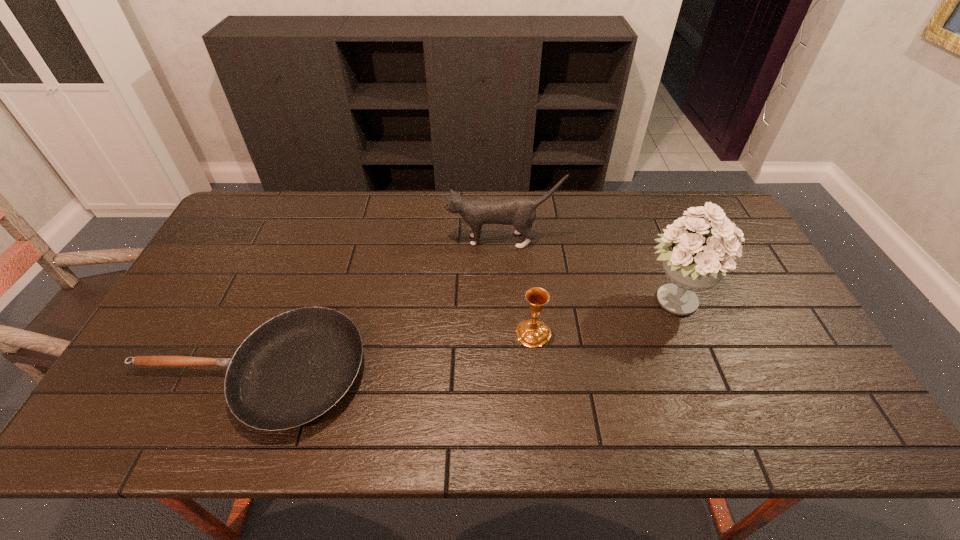
The height and width of the screenshot is (540, 960). I want to click on free space at the right edge, so click(785, 387).

In the image, there is a desktop. Find the location of `vacant space at the far left corner`. vacant space at the far left corner is located at coordinates (229, 234).

Find the location of a particular element. This screenshot has width=960, height=540. blank space at the far right corner of the desktop is located at coordinates (704, 202).

What are the coordinates of `unoccupied position between the chalice and the tallest object` in the screenshot? It's located at (603, 317).

Identify the location of vacant point located between the bouquet and the cat. pyautogui.click(x=588, y=271).

Locate an element on the screen. free space between the leftmost object and the cat is located at coordinates (375, 307).

The height and width of the screenshot is (540, 960). I want to click on free space that is in between the second shortest object and the bouquet, so click(x=603, y=317).

The image size is (960, 540). Identify the location of vacant space that is in between the chalice and the third shortest object. (517, 287).

At what (x,y) coordinates should I click in order to perform the action: click on vacant area that lies between the shortest object and the tallest object. Please return your answer as a coordinate pair (x, y). This screenshot has height=540, width=960. Looking at the image, I should click on (461, 336).

Where is `free spot between the leftmost object and the third tallest object`? This screenshot has width=960, height=540. free spot between the leftmost object and the third tallest object is located at coordinates tap(391, 353).